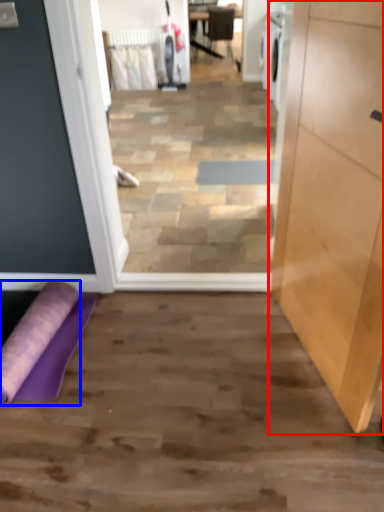
Question: Which object is further to the camera taking this photo, cabinetry (highlighted by a red box) or beach towel (highlighted by a blue box)?

Choices:
 (A) cabinetry
 (B) beach towel

Answer: (B)